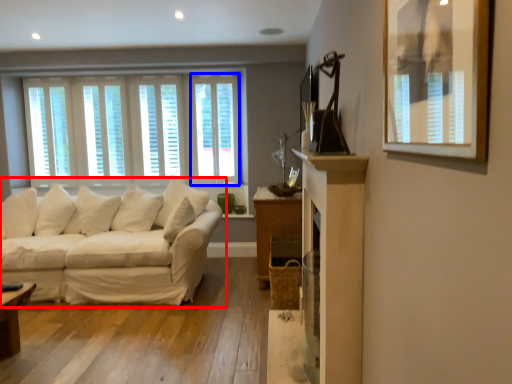
Question: Which point is closer to the camera, studio couch (highlighted by a red box) or window (highlighted by a blue box)?

Choices:
 (A) studio couch
 (B) window

Answer: (A)